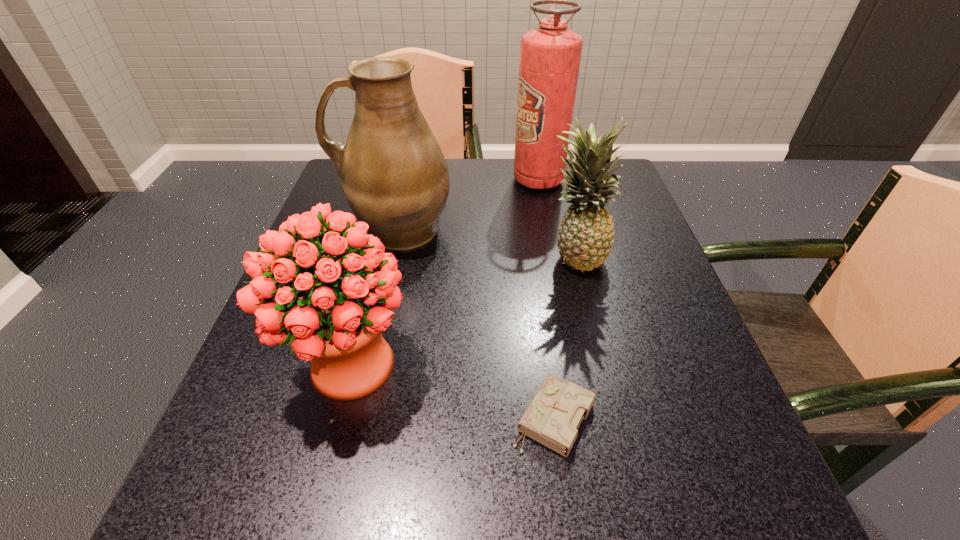
The height and width of the screenshot is (540, 960). Find the location of `vacant area located 0.280m on the left of the shortest object`. vacant area located 0.280m on the left of the shortest object is located at coordinates (324, 417).

Where is `fire extinguisher that is at the far edge`? This screenshot has height=540, width=960. fire extinguisher that is at the far edge is located at coordinates (550, 55).

Locate an element on the screen. pitcher present at the far edge is located at coordinates (395, 178).

Where is `pitcher that is at the left edge`? This screenshot has height=540, width=960. pitcher that is at the left edge is located at coordinates (395, 178).

This screenshot has height=540, width=960. I want to click on bouquet located in the left edge section of the desktop, so click(337, 323).

The height and width of the screenshot is (540, 960). In order to click on fire extinguisher located at the right edge in this screenshot , I will do `click(550, 55)`.

Where is `pineapple present at the right edge`? The width and height of the screenshot is (960, 540). pineapple present at the right edge is located at coordinates (585, 236).

You are a GUI agent. You are given a task and a screenshot of the screen. Output one action in this format:
    pyautogui.click(x=<x>, y=<y>)
    Task: Click on the object that is at the far left corner
    
    Given the screenshot: What is the action you would take?
    pyautogui.click(x=395, y=178)

Where is `object that is at the far right corner`? This screenshot has width=960, height=540. object that is at the far right corner is located at coordinates (550, 55).

Find the location of a particular element. Image resolution: width=960 pixels, height=540 pixels. vacant space at the far edge is located at coordinates (467, 167).